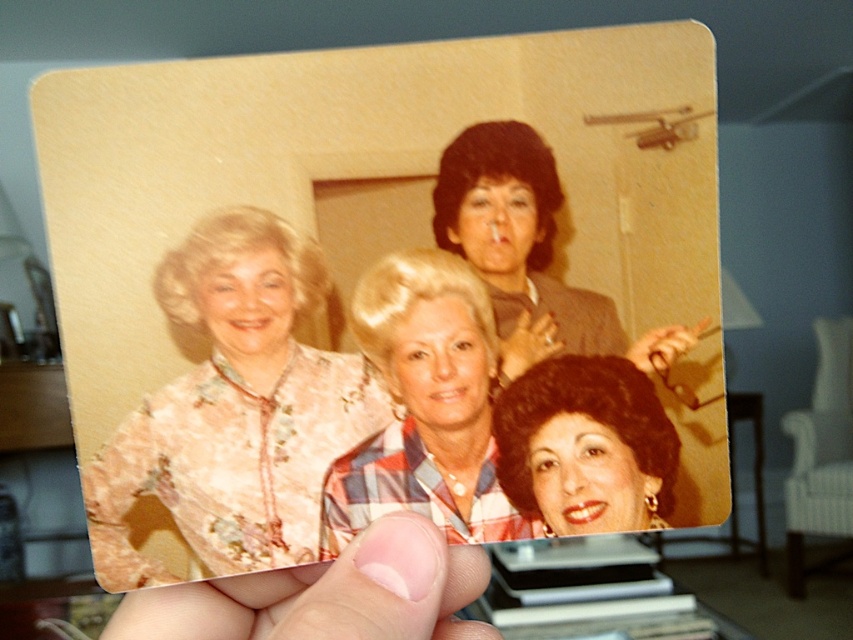
You are an appraiser evaluating this vintage photograph. You notice two distinct clothing items worn by the women in the photo. The plaid fabric shirt at center and the matte gray suit at center. Which clothing item is positioned to the left of the other?

The plaid fabric shirt at center is to the left of the matte gray suit at center.

You are an appraiser examining this vintage photograph. You notice two items of interest in the image. One is the matte gray suit at center, and the other is the shiny dark hair at center. Based on the spatial relationship between them, which one would you say is physically closer to the camera?

The matte gray suit at center is closer to the viewer than the shiny dark hair at center, so the matte gray suit at center is physically closer to the camera.